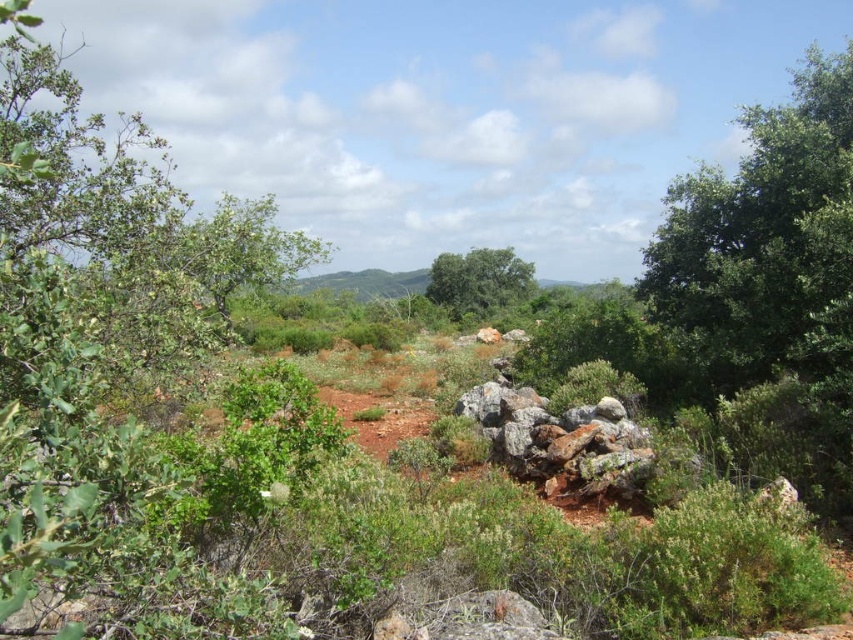
Does green leafy tree at left appear on the right side of green leafy tree at center?

Incorrect, green leafy tree at left is not on the right side of green leafy tree at center.

Can you confirm if green leafy tree at left is taller than green leafy tree at center?

Correct, green leafy tree at left is much taller as green leafy tree at center.

Between point (194, 250) and point (518, 275), which one is positioned in front?

Point (194, 250) is more forward.

The width and height of the screenshot is (853, 640). In order to click on green leafy tree at left in this screenshot , I will do `click(119, 372)`.